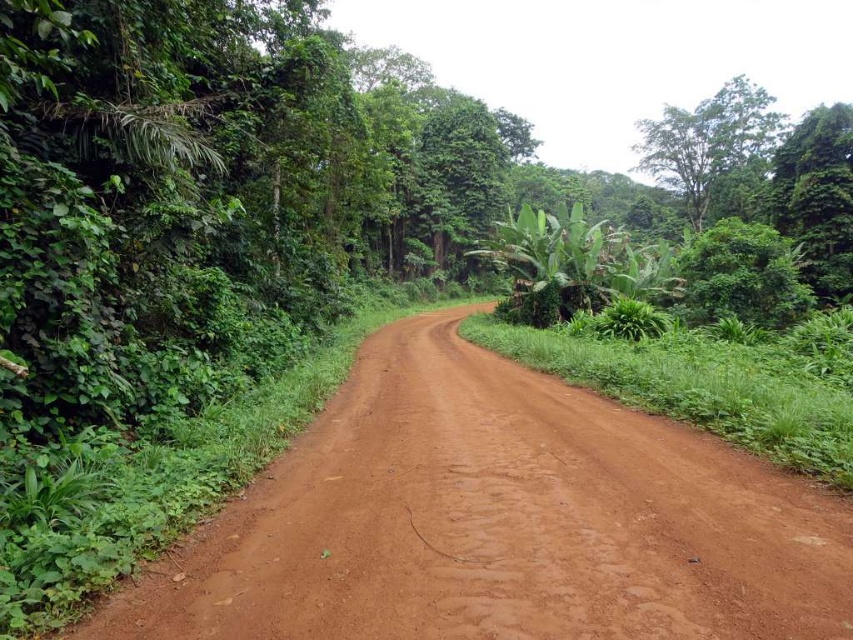
Question: Is dusty brown dirt track at center below green leafy tree at upper right?

Choices:
 (A) no
 (B) yes

Answer: (B)

Question: Among these objects, which one is nearest to the camera?

Choices:
 (A) green leafy tree at upper right
 (B) dusty brown dirt track at center

Answer: (B)

Question: Can you confirm if dusty brown dirt track at center is smaller than green leafy tree at upper right?

Choices:
 (A) no
 (B) yes

Answer: (B)

Question: Among these objects, which one is farthest from the camera?

Choices:
 (A) green leafy tree at upper right
 (B) dusty brown dirt track at center

Answer: (A)

Question: Which point is farther to the camera?

Choices:
 (A) dusty brown dirt track at center
 (B) green leafy tree at upper right

Answer: (B)

Question: Does dusty brown dirt track at center appear on the left side of green leafy tree at upper right?

Choices:
 (A) yes
 (B) no

Answer: (A)